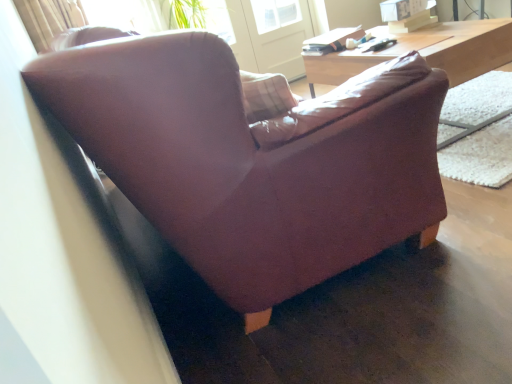
Question: Considering the relative positions of transparent glass screen door at upper center and wooden desk at upper right in the image provided, is transparent glass screen door at upper center to the left or to the right of wooden desk at upper right?

Choices:
 (A) right
 (B) left

Answer: (B)

Question: From the image's perspective, is transparent glass screen door at upper center located above or below wooden desk at upper right?

Choices:
 (A) above
 (B) below

Answer: (A)

Question: Which is farther from the wooden desk at upper right?

Choices:
 (A) leather couch at center
 (B) transparent glass screen door at upper center

Answer: (B)

Question: Considering the real-world distances, which object is farthest from the leather couch at center?

Choices:
 (A) wooden desk at upper right
 (B) transparent glass screen door at upper center

Answer: (B)